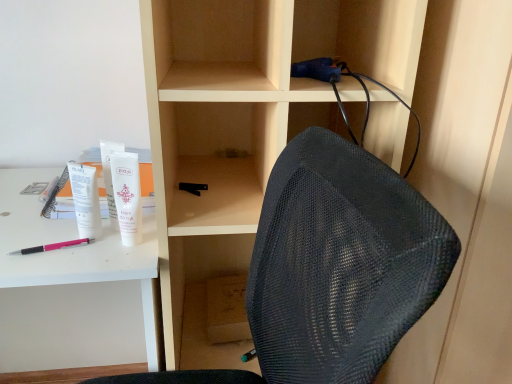
Identify the location of vacant space positioned to the left of white matte tube at upper left, which is the second stationery in left-to-right order. The width and height of the screenshot is (512, 384). (40, 221).